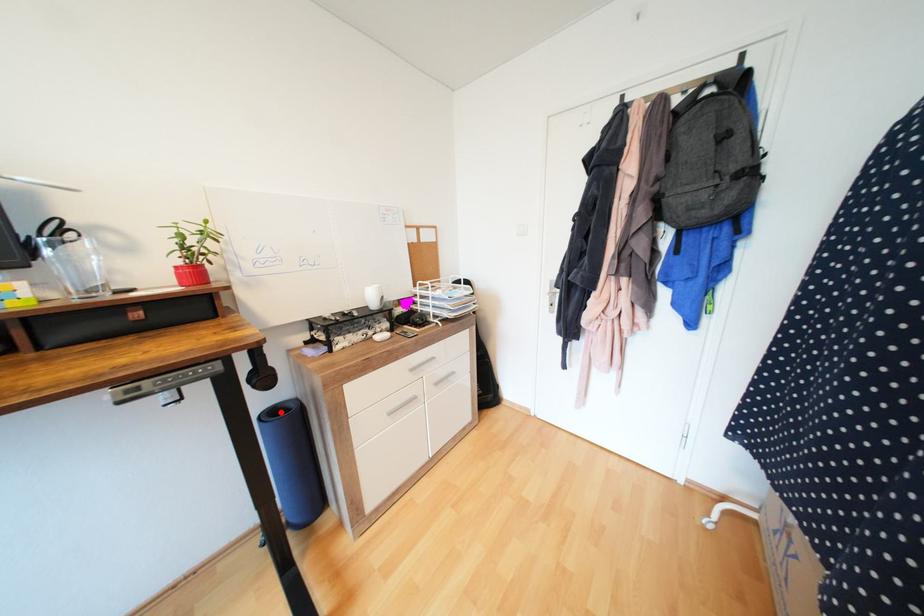
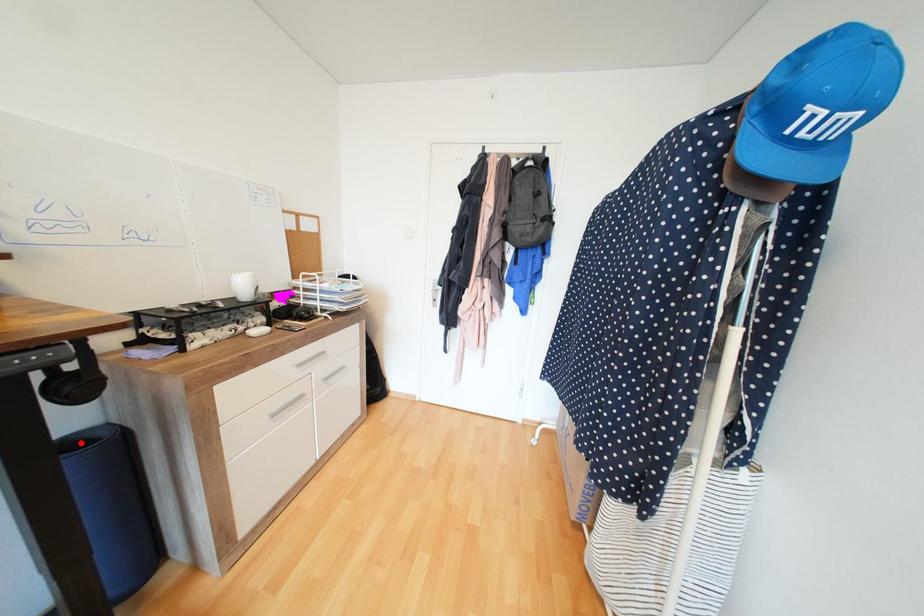
I am providing you with two images of the same scene from different viewpoints. A red point is marked on the first image and another point is marked on the second image. Is the red point in image1 aligned with the point shown in image2?

Yes